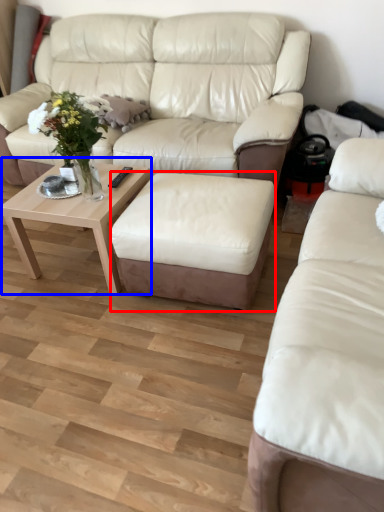
Question: Among these objects, which one is farthest to the camera, stool (highlighted by a red box) or coffee table (highlighted by a blue box)?

Choices:
 (A) stool
 (B) coffee table

Answer: (B)